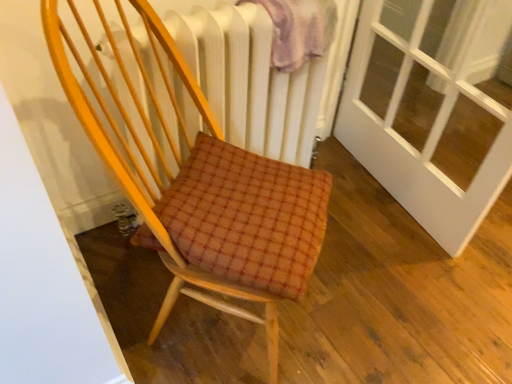
Question: Can you confirm if plush pink blanket at upper center is bigger than wooden chair at center?

Choices:
 (A) yes
 (B) no

Answer: (B)

Question: Is plush pink blanket at upper center not inside wooden chair at center?

Choices:
 (A) yes
 (B) no

Answer: (A)

Question: Is plush pink blanket at upper center next to wooden chair at center and touching it?

Choices:
 (A) no
 (B) yes

Answer: (A)

Question: Is plush pink blanket at upper center oriented away from wooden chair at center?

Choices:
 (A) yes
 (B) no

Answer: (B)

Question: Is plush pink blanket at upper center facing towards wooden chair at center?

Choices:
 (A) no
 (B) yes

Answer: (A)

Question: Based on their positions, is wooden chair at center located to the left or right of plush pink blanket at upper center?

Choices:
 (A) left
 (B) right

Answer: (A)

Question: Considering the positions of wooden chair at center and plush pink blanket at upper center in the image, is wooden chair at center taller or shorter than plush pink blanket at upper center?

Choices:
 (A) tall
 (B) short

Answer: (A)

Question: From a real-world perspective, is wooden chair at center physically located above or below plush pink blanket at upper center?

Choices:
 (A) below
 (B) above

Answer: (A)

Question: From the image's perspective, relative to plush pink blanket at upper center, is wooden chair at center above or below?

Choices:
 (A) above
 (B) below

Answer: (B)

Question: Is plush pink blanket at upper center to the left or to the right of white textured radiator at upper center in the image?

Choices:
 (A) right
 (B) left

Answer: (A)

Question: Considering the positions of point (280, 56) and point (227, 11), is point (280, 56) closer or farther from the camera than point (227, 11)?

Choices:
 (A) farther
 (B) closer

Answer: (A)

Question: From their relative heights in the image, would you say plush pink blanket at upper center is taller or shorter than white textured radiator at upper center?

Choices:
 (A) short
 (B) tall

Answer: (A)

Question: Considering the positions of plush pink blanket at upper center and white textured radiator at upper center in the image, is plush pink blanket at upper center bigger or smaller than white textured radiator at upper center?

Choices:
 (A) small
 (B) big

Answer: (A)

Question: Looking at their shapes, would you say wooden chair at center is wider or thinner than white textured radiator at upper center?

Choices:
 (A) thin
 (B) wide

Answer: (B)

Question: Would you say wooden chair at center is inside or outside white textured radiator at upper center?

Choices:
 (A) inside
 (B) outside

Answer: (B)